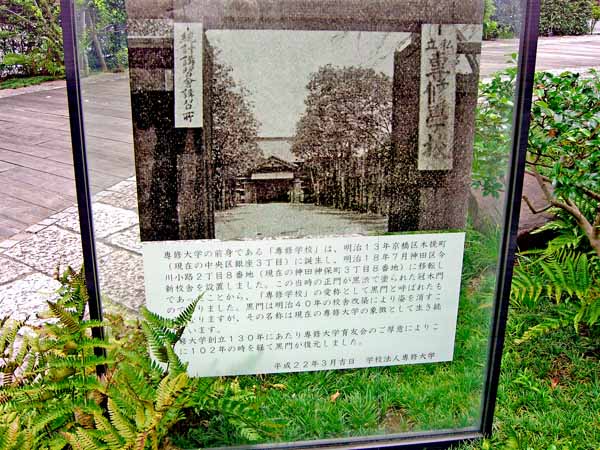
Locate an element on the screen. The image size is (600, 450). wooden boards is located at coordinates (23, 159).